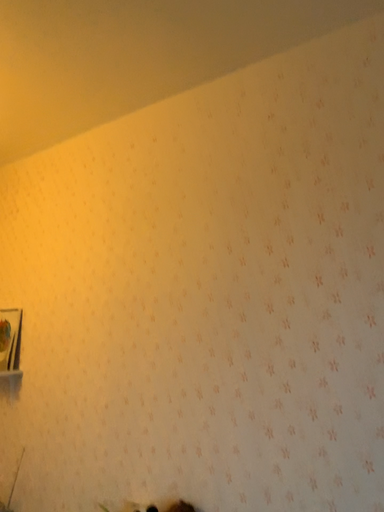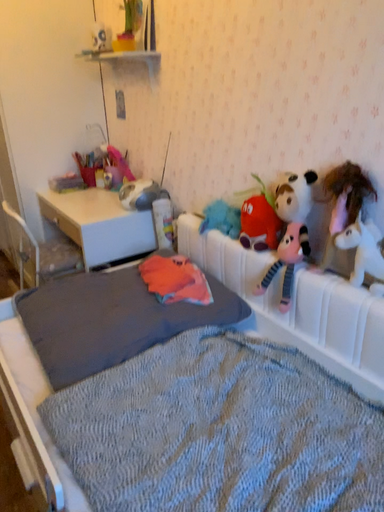
Question: How did the camera likely rotate when shooting the video?

Choices:
 (A) rotated upward
 (B) rotated downward

Answer: (B)